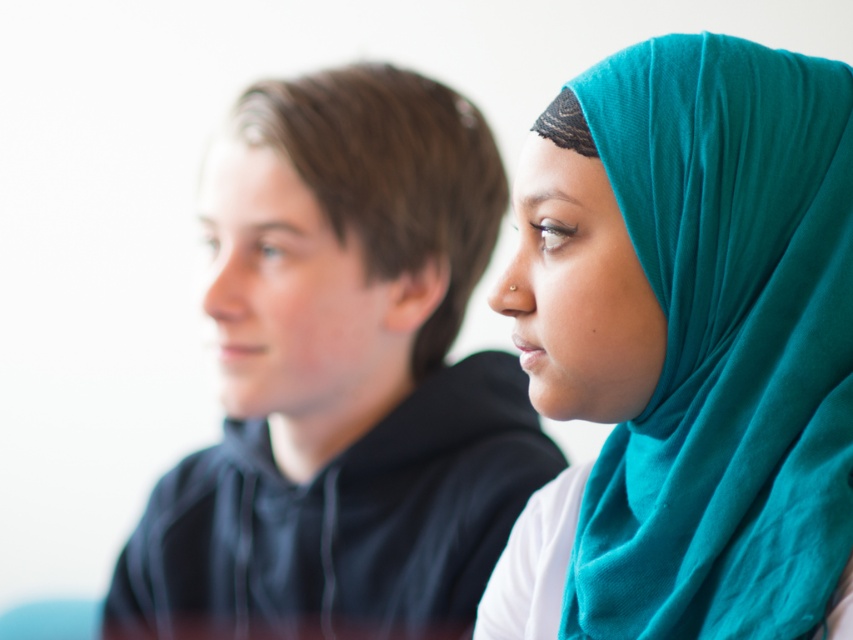
Question: Does teal fabric hijab at right have a smaller size compared to black matte hoodie at left?

Choices:
 (A) yes
 (B) no

Answer: (A)

Question: Which object is closer to the camera taking this photo?

Choices:
 (A) teal fabric hijab at right
 (B) black matte hoodie at left

Answer: (A)

Question: Can you confirm if teal fabric hijab at right is positioned to the left of black matte hoodie at left?

Choices:
 (A) yes
 (B) no

Answer: (B)

Question: Can you confirm if teal fabric hijab at right is positioned above black matte hoodie at left?

Choices:
 (A) yes
 (B) no

Answer: (A)